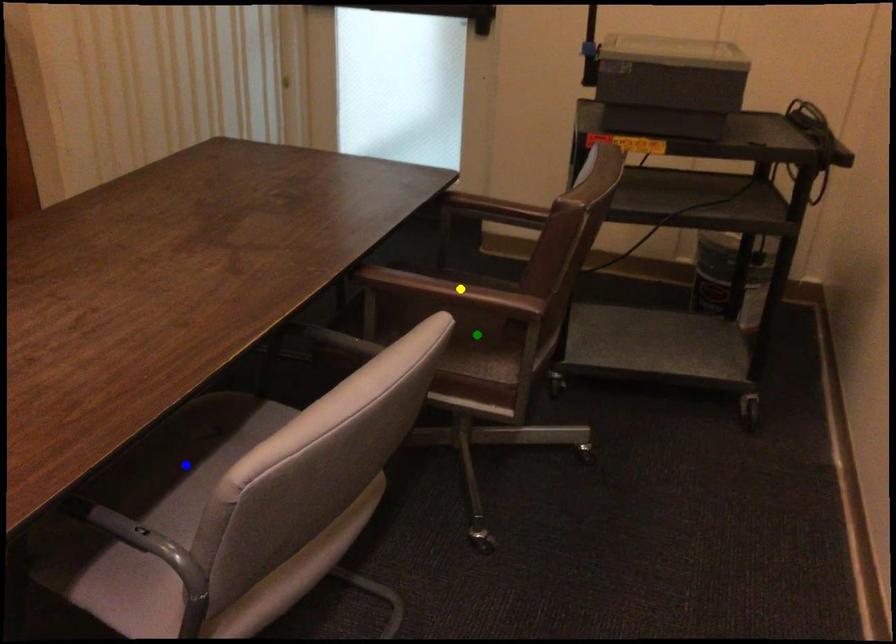
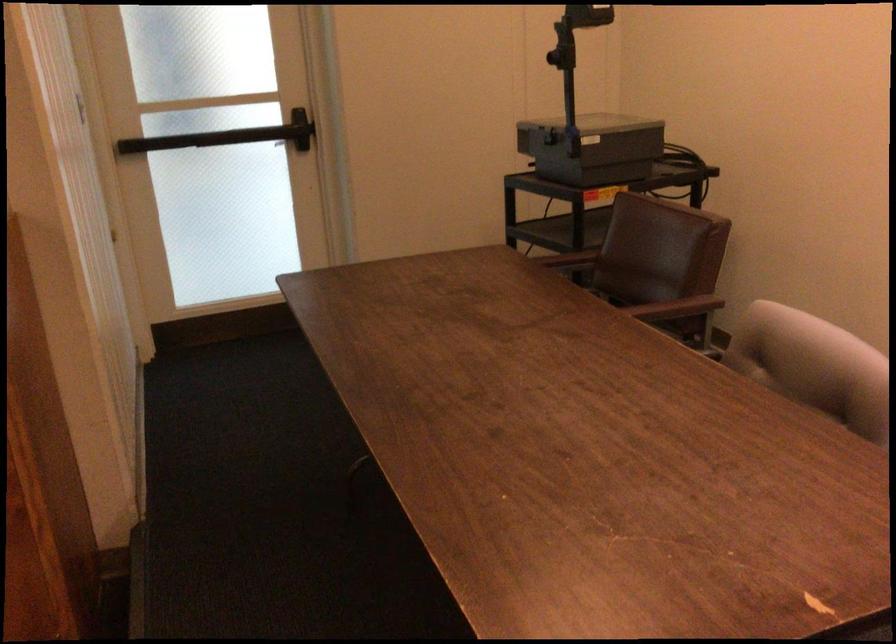
I am providing you with two images of the same scene from different viewpoints. Three points are marked in image1. Which point corresponds to a part or object that is occluded in image2?In image1, three points are marked. Which of them correspond to a part or object that is occluded in image2?Among the three points shown in image1, which one corresponds to a part or object that is no longer visible due to occlusion in image2?

Invisible in image2: yellow point, blue point, green point.